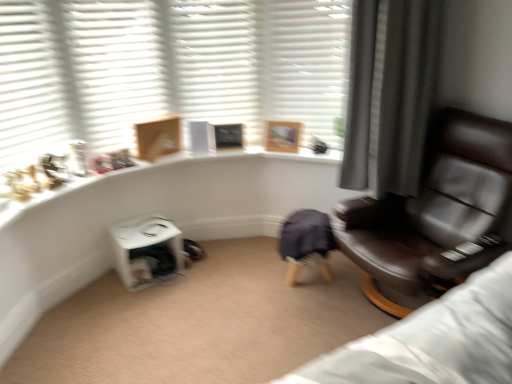
Question: Is white matte shutter at upper center, marked as the third shutter in a left-to-right arrangement, positioned with its back to white matte shutter at upper center, arranged as the first shutter when viewed from the right?

Choices:
 (A) no
 (B) yes

Answer: (A)

Question: Is white matte shutter at upper center, the second shutter from the right, wider than white matte shutter at upper center, arranged as the first shutter when viewed from the right?

Choices:
 (A) no
 (B) yes

Answer: (A)

Question: Is white matte shutter at upper center, marked as the third shutter in a left-to-right arrangement, oriented towards white matte shutter at upper center, which appears as the 4th shutter when viewed from the left?

Choices:
 (A) yes
 (B) no

Answer: (B)

Question: Can you confirm if white matte shutter at upper center, the second shutter from the right, is thinner than white matte shutter at upper center, arranged as the first shutter when viewed from the right?

Choices:
 (A) no
 (B) yes

Answer: (B)

Question: Is white matte shutter at upper center, marked as the third shutter in a left-to-right arrangement, positioned behind white matte shutter at upper center, which appears as the 4th shutter when viewed from the left?

Choices:
 (A) no
 (B) yes

Answer: (B)

Question: From their relative heights in the image, would you say brown leather chair at right is taller or shorter than white matte shutter at upper left, the second shutter when ordered from left to right?

Choices:
 (A) tall
 (B) short

Answer: (A)

Question: Considering their positions, is brown leather chair at right located in front of or behind white matte shutter at upper left, the second shutter when ordered from left to right?

Choices:
 (A) front
 (B) behind

Answer: (A)

Question: Is brown leather chair at right inside the boundaries of white matte shutter at upper left, marked as the third shutter in a right-to-left arrangement, or outside?

Choices:
 (A) inside
 (B) outside

Answer: (B)

Question: From a real-world perspective, relative to white matte shutter at upper left, marked as the third shutter in a right-to-left arrangement, is brown leather chair at right vertically above or below?

Choices:
 (A) above
 (B) below

Answer: (B)

Question: Which is correct: wooden picture frame at upper center is inside white matte shutter at upper left, marked as the third shutter in a right-to-left arrangement, or outside of it?

Choices:
 (A) outside
 (B) inside

Answer: (A)

Question: Relative to white matte shutter at upper left, marked as the third shutter in a right-to-left arrangement, is wooden picture frame at upper center in front or behind?

Choices:
 (A) front
 (B) behind

Answer: (B)

Question: In terms of size, does wooden picture frame at upper center appear bigger or smaller than white matte shutter at upper left, marked as the third shutter in a right-to-left arrangement?

Choices:
 (A) big
 (B) small

Answer: (B)

Question: In terms of width, does wooden picture frame at upper center look wider or thinner when compared to white matte shutter at upper left, the second shutter when ordered from left to right?

Choices:
 (A) thin
 (B) wide

Answer: (A)

Question: Based on their positions, is white matte shutter at upper center, the second shutter from the right, located to the left or right of white plastic table at lower center?

Choices:
 (A) left
 (B) right

Answer: (B)

Question: In terms of width, does white matte shutter at upper center, the second shutter from the right, look wider or thinner when compared to white plastic table at lower center?

Choices:
 (A) wide
 (B) thin

Answer: (B)